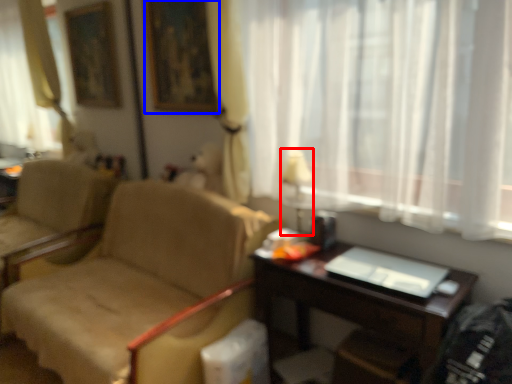
Question: Which of the following is the farthest to the observer, table lamp (highlighted by a red box) or picture frame (highlighted by a blue box)?

Choices:
 (A) table lamp
 (B) picture frame

Answer: (B)